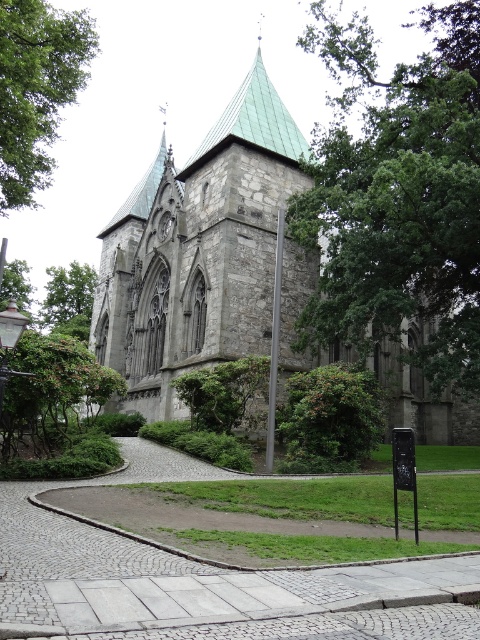
You are standing at the entrance of the historic stone church and want to take a photo of the green leafy tree at upper right. If your camera has a maximum zoom range of 150 feet, will you be able to capture the tree clearly without moving closer?

The green leafy tree at upper right is 189.16 feet away from the viewer. Since the camera can only zoom up to 150 feet, you won cannot capture the tree clearly without moving closer.

You are a landscape architect planning to plant a new tree in the garden. The stone church at center and the green leafy tree at upper left are already present. Which object is wider, and would you need to consider spacing when placing the new tree?

The stone church at center is wider than the green leafy tree at upper left. When placing the new tree, you should consider the spacing based on the church width since it is the larger structure.

You are standing at the entrance of the historic stone church and want to take a photo of both the green leafy tree at upper right and the green leafy tree at upper left. Which direction should you face to ensure both trees are in your camera view?

You should face towards the center of the church because the green leafy tree at upper right is to the right of the green leafy tree at upper left, so positioning yourself at the center allows both trees to be captured in the frame.